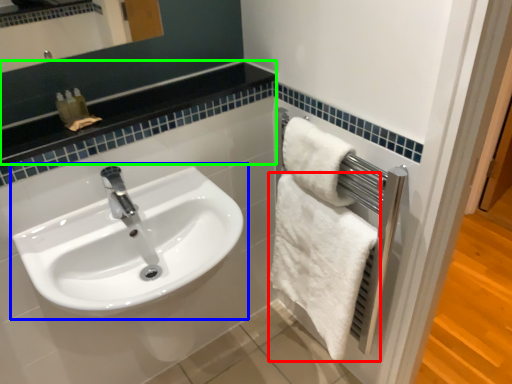
Question: Based on their relative distances, which object is farther from towel (highlighted by a red box)? Choose from sink (highlighted by a blue box) and balustrade (highlighted by a green box).

Choices:
 (A) sink
 (B) balustrade

Answer: (B)